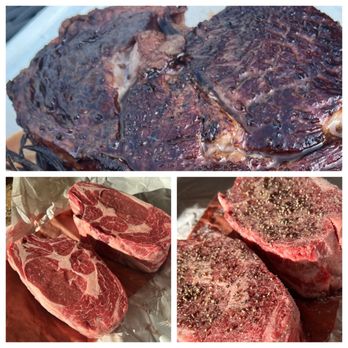
Locate an element on the screen. This screenshot has width=348, height=348. plate is located at coordinates (41, 24).